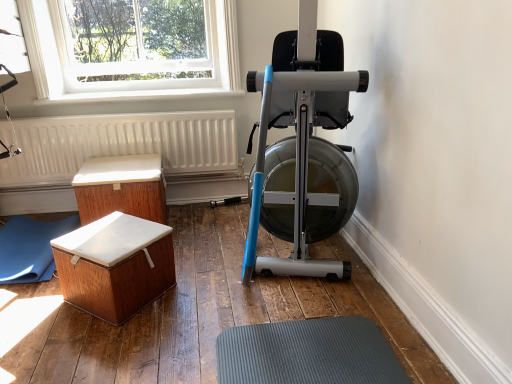
Where is `vacant region in front of silver metallic stationary bicycle at center`? The height and width of the screenshot is (384, 512). vacant region in front of silver metallic stationary bicycle at center is located at coordinates (270, 337).